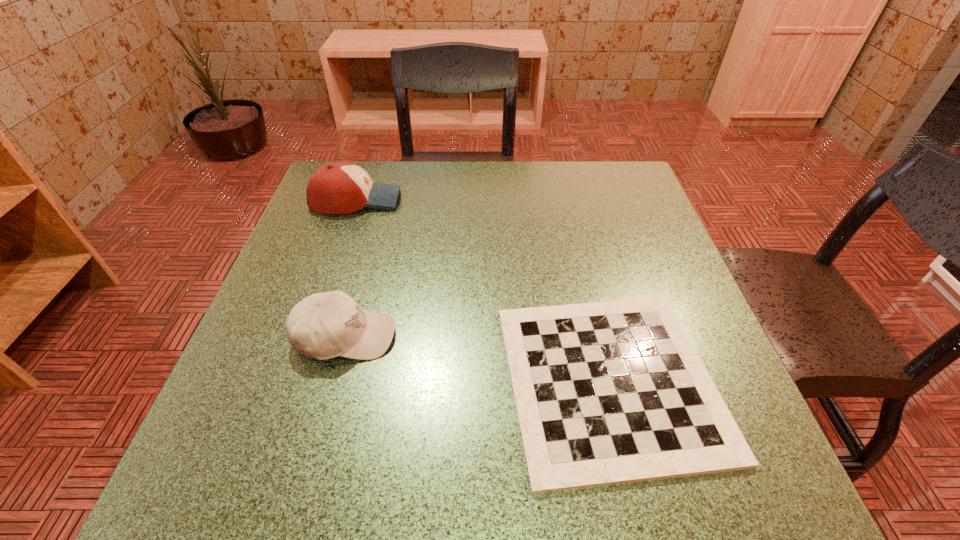
Find the location of a particular element. Image resolution: width=960 pixels, height=540 pixels. the farthest object is located at coordinates (340, 187).

This screenshot has width=960, height=540. Find the location of `the nearer baseball cap`. the nearer baseball cap is located at coordinates (325, 325).

This screenshot has width=960, height=540. Find the location of `the rightmost object`. the rightmost object is located at coordinates (613, 392).

Where is `checkerboard`? Image resolution: width=960 pixels, height=540 pixels. checkerboard is located at coordinates (613, 392).

The image size is (960, 540). I want to click on vacant point located on the front-facing side of the farther baseball cap, so click(541, 199).

In order to click on free space located 0.390m on the front-facing side of the nearer baseball cap in this screenshot , I will do `click(612, 336)`.

Find the location of `free region located on the left of the rightmost object`. free region located on the left of the rightmost object is located at coordinates (284, 381).

Identify the location of object present at the far edge. (340, 187).

Locate an element on the screen. The height and width of the screenshot is (540, 960). object that is positioned at the near edge is located at coordinates (613, 392).

I want to click on object located in the right edge section of the desktop, so click(613, 392).